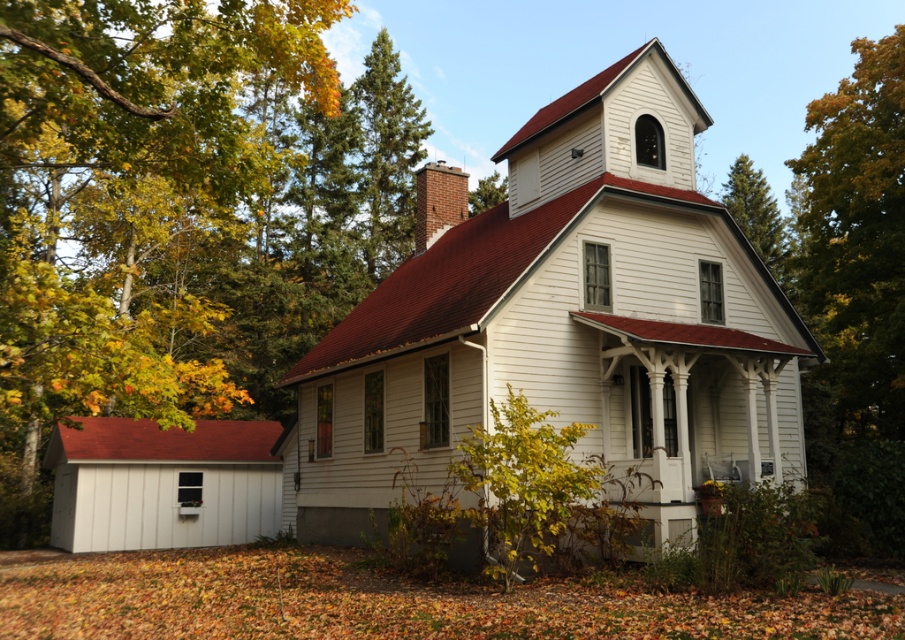
Who is positioned more to the left, green coniferous tree at upper center or green leafy tree at upper center?

green coniferous tree at upper center

Between point (417, 136) and point (480, 205), which one is positioned behind?

The point (480, 205) is more distant.

Does point (386, 188) come closer to viewer compared to point (488, 195)?

Yes, it is.

I want to click on green coniferous tree at upper center, so pyautogui.click(x=386, y=157).

Does green leafy tree at left appear on the right side of green coniferous tree at upper center?

Incorrect, green leafy tree at left is not on the right side of green coniferous tree at upper center.

Is green leafy tree at left wider than green coniferous tree at upper center?

Yes.

Is point (221, 4) more distant than point (403, 90)?

No, (221, 4) is closer to viewer.

Find the location of a particular element. This screenshot has height=640, width=905. green leafy tree at left is located at coordinates (181, 211).

Consider the image. Between green leafy tree at left and white wood chapel at center, which one has more height?

Standing taller between the two is green leafy tree at left.

Who is more forward, (239, 140) or (326, 422)?

Point (239, 140)

Which is behind, point (296, 100) or point (716, 300)?

Positioned behind is point (296, 100).

Find the location of a particular element. This screenshot has width=905, height=640. green leafy tree at left is located at coordinates (181, 211).